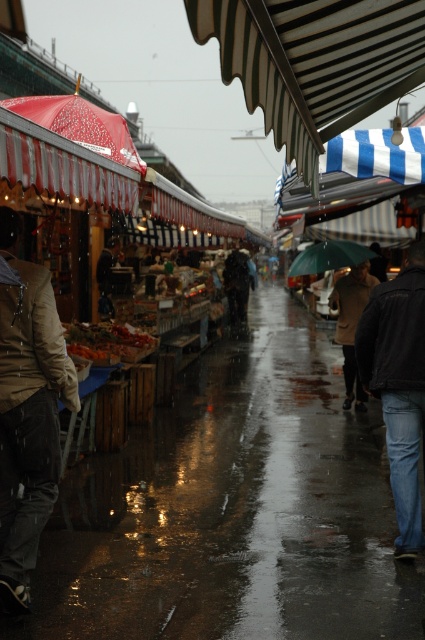
Looking at this image, which is below, white striped awning at upper center or brown wool coat at center?

brown wool coat at center is lower down.

Who is more forward, (312, 17) or (334, 300)?

Point (312, 17) is more forward.

Where is `white striped awning at upper center`? This screenshot has width=425, height=640. white striped awning at upper center is located at coordinates (314, 61).

Locate an element on the screen. Image resolution: width=425 pixels, height=640 pixels. white striped awning at upper center is located at coordinates (314, 61).

Does tan leather jacket at left have a lesser height compared to green matte umbrella at center?

No.

Is point (17, 369) positioned after point (320, 248)?

No, (17, 369) is in front of (320, 248).

Locate an element on the screen. tan leather jacket at left is located at coordinates (28, 412).

Consider the image. Measure the distance from black leather jacket at lower right to green matte umbrella at center.

15.65 feet

Consider the image. Can you confirm if black leather jacket at lower right is positioned to the left of green matte umbrella at center?

Indeed, black leather jacket at lower right is positioned on the left side of green matte umbrella at center.

Find the location of a particular element. This screenshot has width=425, height=640. black leather jacket at lower right is located at coordinates (399, 385).

Locate an element on the screen. black leather jacket at lower right is located at coordinates (399, 385).